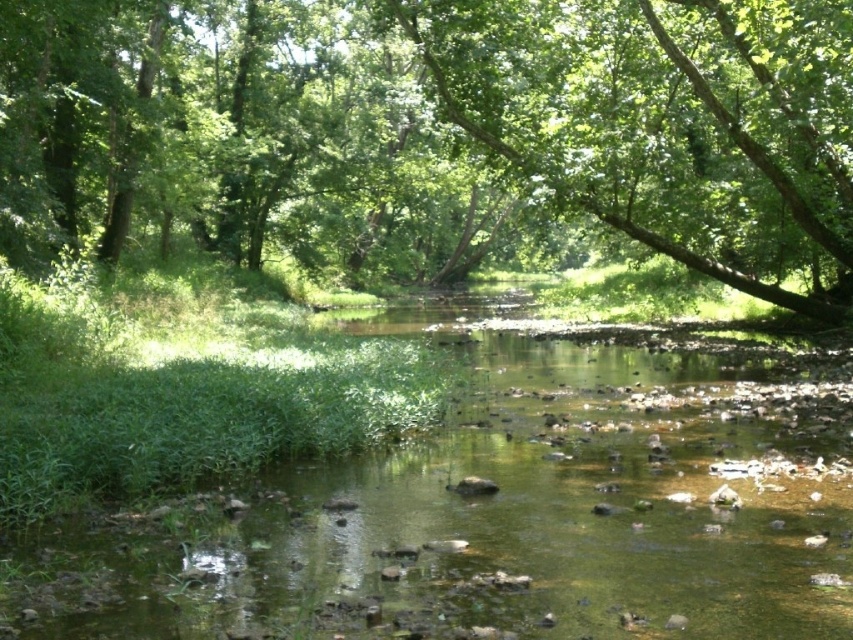
You are standing at the origin point in the scene. You see two points marked in the image. Which point is closer to you, point (738, 172) or point (610, 572)?

Point (610, 572) is closer to you because it is in front of point (738, 172) according to the description.

You are a hiker who wants to take a photo of the clear water at center and the green leafy tree at center. Which object should you focus on first if you want to capture both in sharp focus?

The green leafy tree at center should be focused on first because it is closer to you than the clear water at center, which is behind it.

You are standing at the center of the stream and want to locate the green leafy tree at center. According to the coordinates provided, in which direction should you look to see it?

The green leafy tree at center is located at coordinates point (436, 129). Since you are at the center of the stream, you should look towards the direction of the tree which is slightly to the left and above your current position based on the coordinates provided.